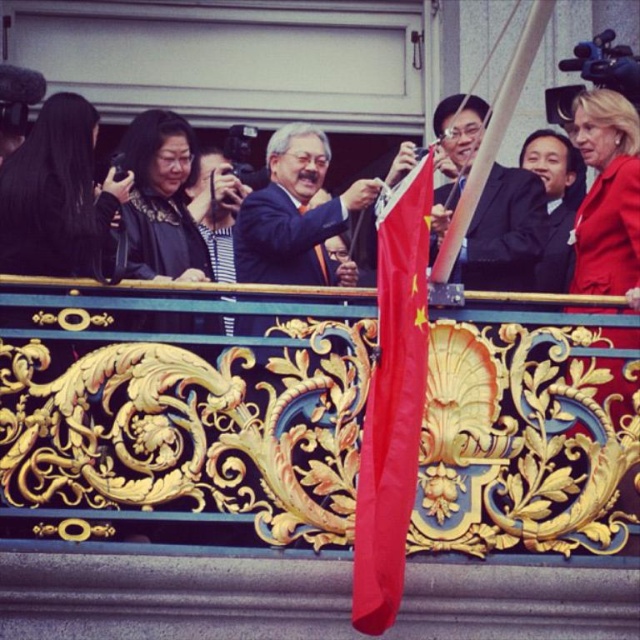
Does red matte flag at center have a greater width compared to smooth black suit at center?

Incorrect, red matte flag at center's width does not surpass smooth black suit at center's.

Between point (413, 227) and point (392, 163), which one is positioned behind?

Positioned behind is point (392, 163).

This screenshot has height=640, width=640. Describe the element at coordinates (392, 403) in the screenshot. I see `red matte flag at center` at that location.

This screenshot has width=640, height=640. I want to click on red matte flag at center, so click(392, 403).